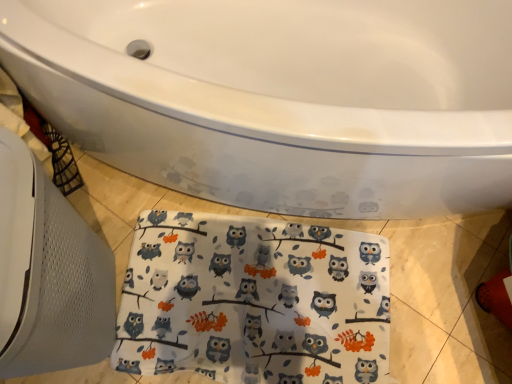
Question: In which direction should I rotate to look at white fabric with owl print at lower center?

Choices:
 (A) right
 (B) left

Answer: (A)

Question: Is the depth of white glossy bathtub at center less than that of white fabric with owl print at lower center?

Choices:
 (A) no
 (B) yes

Answer: (B)

Question: From the image's perspective, is white glossy bathtub at center located beneath white fabric with owl print at lower center?

Choices:
 (A) no
 (B) yes

Answer: (A)

Question: Is white glossy bathtub at center positioned behind white fabric with owl print at lower center?

Choices:
 (A) no
 (B) yes

Answer: (A)

Question: Can you confirm if white glossy bathtub at center is taller than white fabric with owl print at lower center?

Choices:
 (A) no
 (B) yes

Answer: (B)

Question: Is white glossy bathtub at center not close to white fabric with owl print at lower center?

Choices:
 (A) yes
 (B) no

Answer: (B)

Question: Can you confirm if white glossy bathtub at center is positioned to the right of white fabric with owl print at lower center?

Choices:
 (A) no
 (B) yes

Answer: (B)

Question: Does white fabric with owl print at lower center lie behind white glossy bathtub at center?

Choices:
 (A) yes
 (B) no

Answer: (A)

Question: Is white fabric with owl print at lower center wider than white glossy bathtub at center?

Choices:
 (A) yes
 (B) no

Answer: (B)

Question: Is the surface of white fabric with owl print at lower center in direct contact with white glossy bathtub at center?

Choices:
 (A) no
 (B) yes

Answer: (A)

Question: Is white fabric with owl print at lower center oriented away from white glossy bathtub at center?

Choices:
 (A) no
 (B) yes

Answer: (B)

Question: Is white fabric with owl print at lower center positioned far away from white glossy bathtub at center?

Choices:
 (A) no
 (B) yes

Answer: (A)

Question: From a real-world perspective, is white fabric with owl print at lower center located higher than white glossy bathtub at center?

Choices:
 (A) no
 (B) yes

Answer: (A)

Question: Considering the positions of white glossy bathtub at center and white fabric with owl print at lower center in the image, is white glossy bathtub at center taller or shorter than white fabric with owl print at lower center?

Choices:
 (A) tall
 (B) short

Answer: (A)